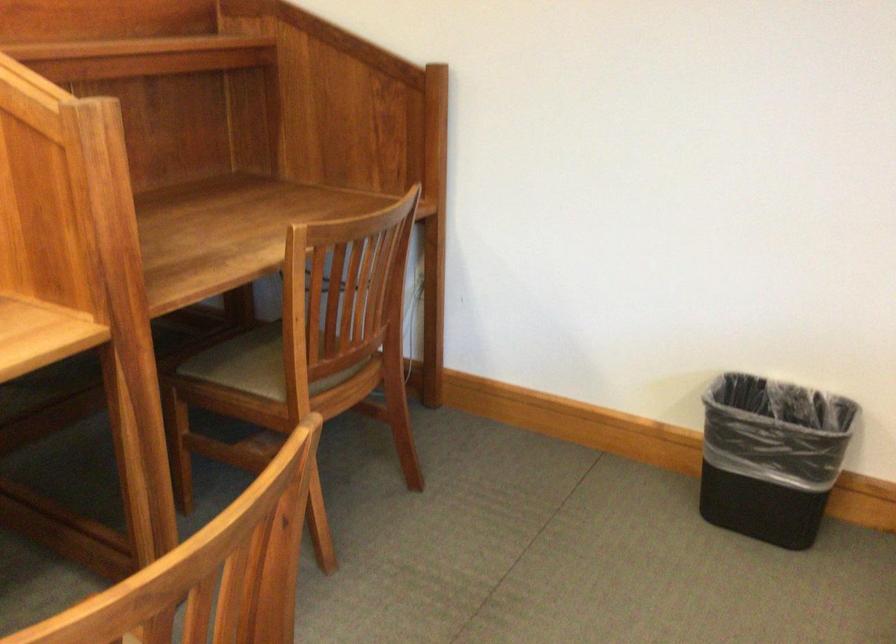
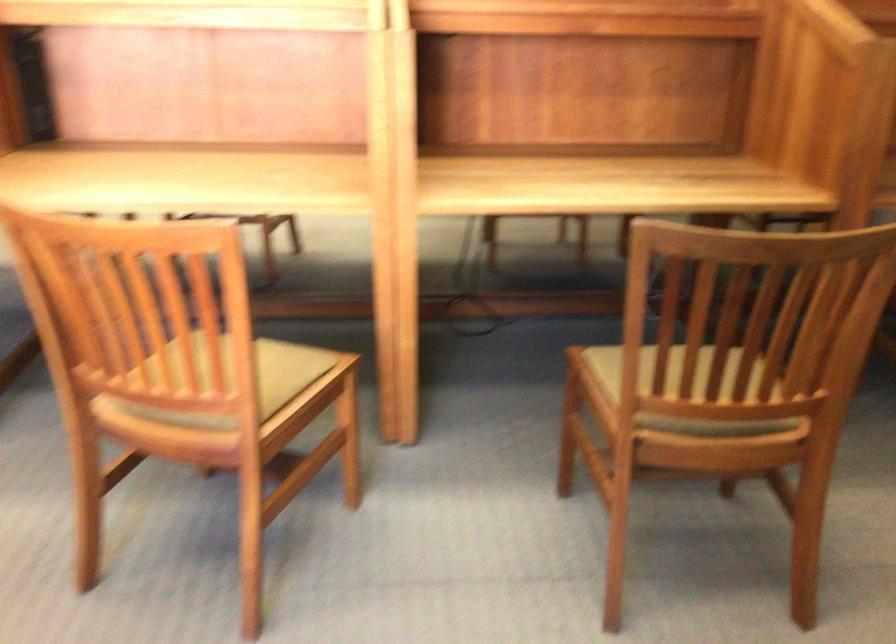
Question: The camera is either moving clockwise (left) or counter-clockwise (right) around the object. The first image is from the beginning of the video and the second image is from the end. Is the camera moving left or right when shooting the video?

Choices:
 (A) Left
 (B) Right

Answer: (B)